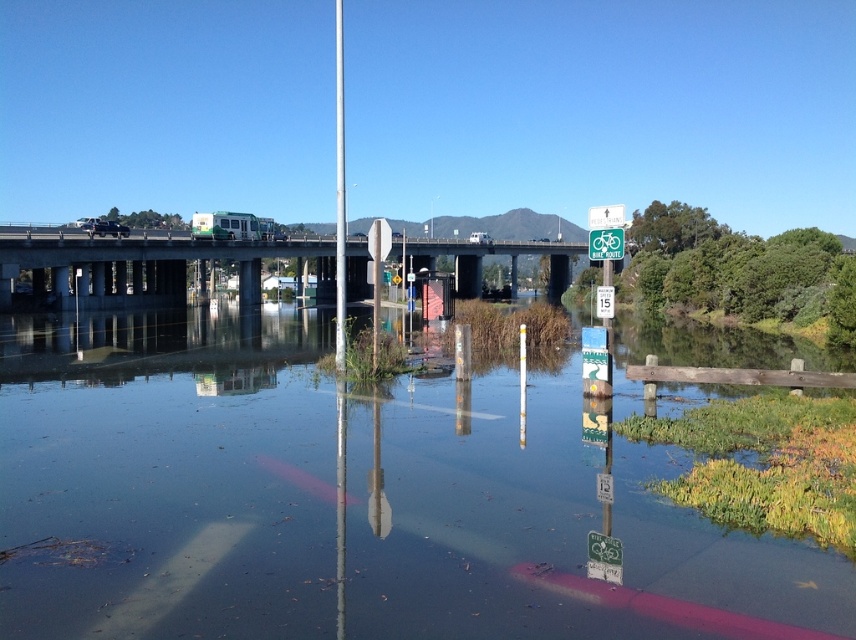
Between clear water at lower center and green plastic bike route sign at center, which one appears on the right side from the viewer's perspective?

green plastic bike route sign at center

Is point (288, 524) positioned before point (605, 237)?

Yes.

Is point (110, 362) more distant than point (593, 237)?

Yes.

Locate an element on the screen. The height and width of the screenshot is (640, 856). clear water at lower center is located at coordinates (351, 499).

Is point (0, 336) less distant than point (339, 352)?

No.

Is clear water at lower center smaller than metallic pole at center?

Indeed, clear water at lower center has a smaller size compared to metallic pole at center.

Where is `clear water at lower center`? clear water at lower center is located at coordinates (351, 499).

At what (x,y) coordinates should I click in order to perform the action: click on clear water at lower center. Please return your answer as a coordinate pair (x, y). This screenshot has height=640, width=856. Looking at the image, I should click on (351, 499).

Is concrete bridge at upper center above metallic pole at center?

Actually, concrete bridge at upper center is below metallic pole at center.

Measure the distance between point (57,244) and camera.

Point (57,244) and camera are 60.40 meters apart.

Does point (455, 253) come farther from viewer compared to point (337, 324)?

That is True.

Where is `concrete bridge at upper center`? The height and width of the screenshot is (640, 856). concrete bridge at upper center is located at coordinates (144, 268).